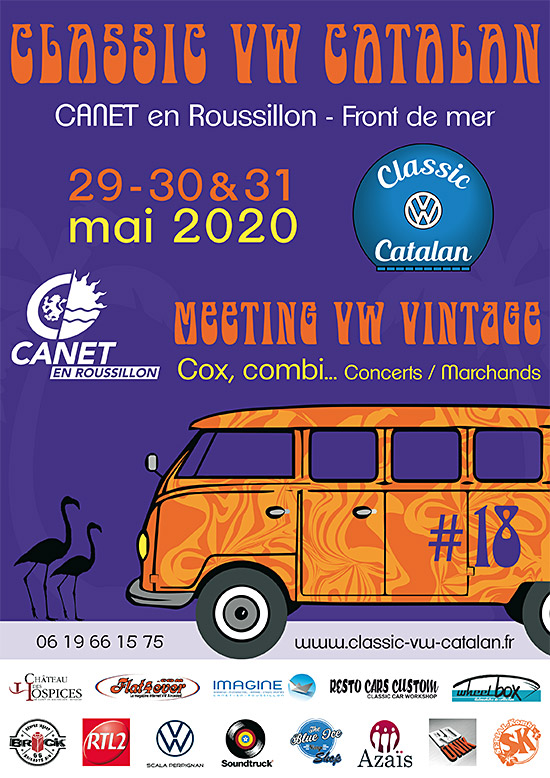
Locate an element on the screen. The image size is (550, 778). mirror is located at coordinates (151, 458).